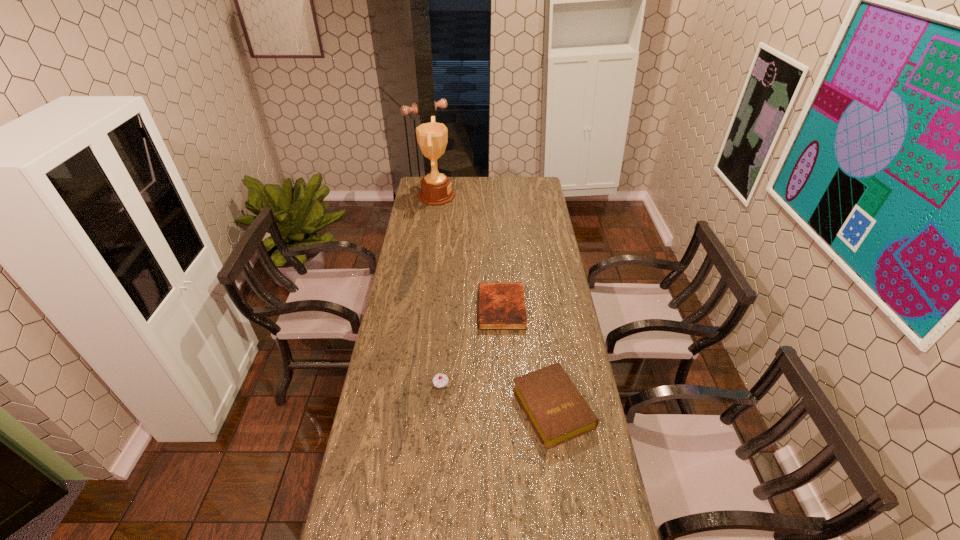
Image resolution: width=960 pixels, height=540 pixels. Find the location of `vacant space situated 0.210m on the spine side of the third nearest object`. vacant space situated 0.210m on the spine side of the third nearest object is located at coordinates (427, 309).

Locate an element on the screen. Image resolution: width=960 pixels, height=540 pixels. free space located 0.160m on the spine side of the third nearest object is located at coordinates (439, 309).

This screenshot has width=960, height=540. In order to click on blank area located on the spine side of the third nearest object in this screenshot , I will do `click(410, 309)`.

This screenshot has height=540, width=960. In order to click on object present at the far edge in this screenshot , I will do `click(436, 190)`.

Identify the location of object positioned at the left edge. (436, 190).

Locate an element on the screen. object that is at the right edge is located at coordinates (556, 409).

Locate an element on the screen. The height and width of the screenshot is (540, 960). object located at the far left corner is located at coordinates (436, 190).

Identify the location of free space at the far edge. (499, 192).

The width and height of the screenshot is (960, 540). Find the location of `free location at the left edge`. free location at the left edge is located at coordinates (371, 517).

Image resolution: width=960 pixels, height=540 pixels. In the image, there is a desktop. Find the location of `vacant space at the right edge`. vacant space at the right edge is located at coordinates (541, 237).